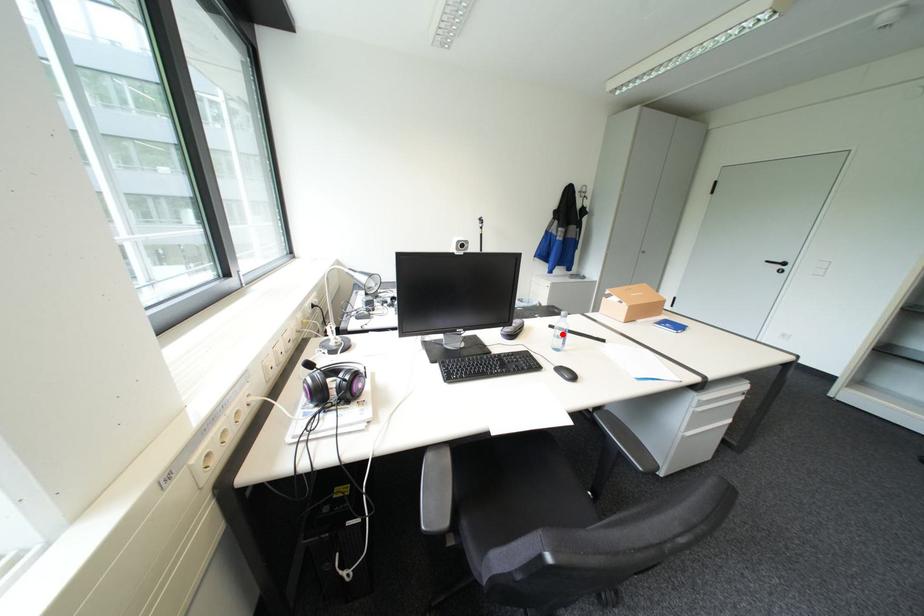
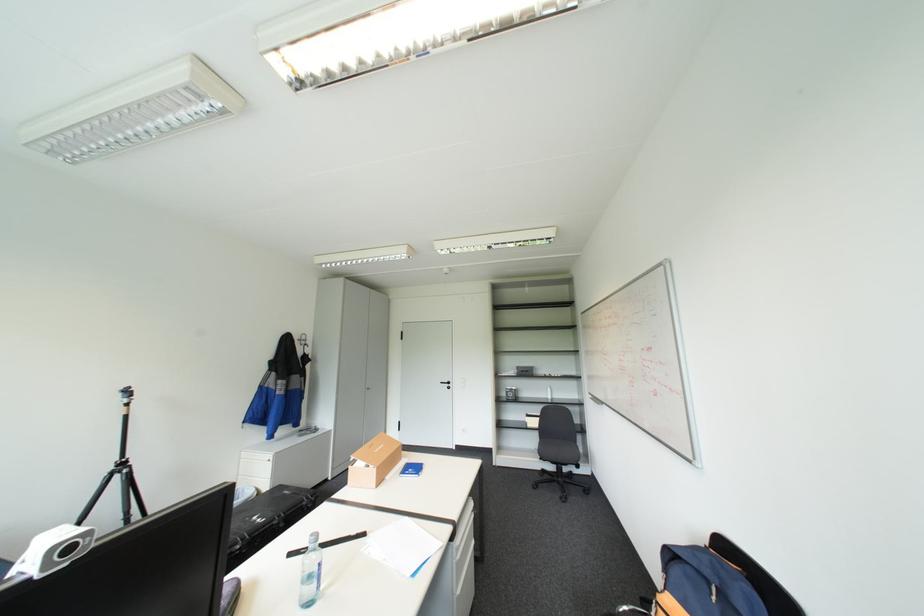
Find the pixel in the second image that matches the highlighted location in the first image.

(310, 581)